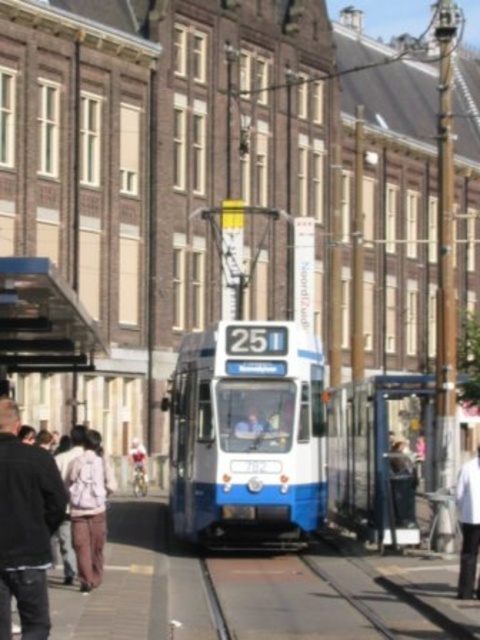
Does brown metal train track at center lie in front of white cotton shirt at center?

Yes, it is.

Does brown metal train track at center have a greater height compared to white cotton shirt at center?

In fact, brown metal train track at center may be shorter than white cotton shirt at center.

Find the location of a particular element. Image resolution: width=480 pixels, height=640 pixels. brown metal train track at center is located at coordinates (324, 600).

The width and height of the screenshot is (480, 640). In order to click on brown metal train track at center in this screenshot , I will do `click(324, 600)`.

Is point (88, 486) behind point (477, 465)?

Yes, it is.

Based on the photo, between light pink fabric pants at lower left and white cotton shirt at center, which one appears on the right side from the viewer's perspective?

Positioned to the right is white cotton shirt at center.

Is point (90, 432) in front of point (468, 497)?

That is False.

Identify the location of light pink fabric pants at lower left. (88, 508).

Who is positioned more to the left, brown metal train track at center or light pink fabric pants at lower left?

light pink fabric pants at lower left is more to the left.

Does brown metal train track at center have a lesser height compared to light pink fabric pants at lower left?

Indeed, brown metal train track at center has a lesser height compared to light pink fabric pants at lower left.

Is point (307, 621) closer to viewer compared to point (107, 490)?

Yes, point (307, 621) is in front of point (107, 490).

Find the location of a particular element. The width and height of the screenshot is (480, 640). brown metal train track at center is located at coordinates (324, 600).